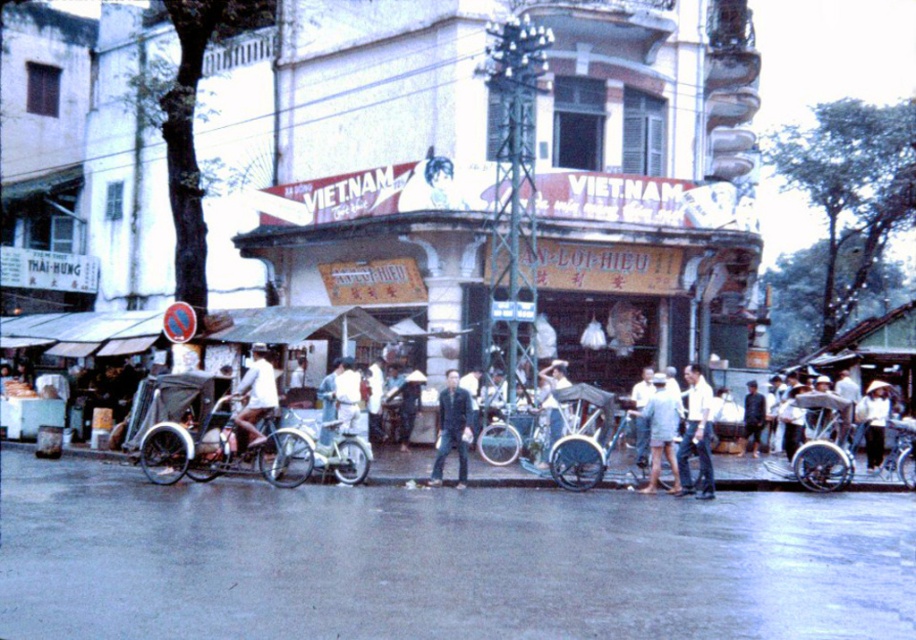
Who is positioned more to the left, metallic silver tricycle at right or dark blue fabric at center?

From the viewer's perspective, metallic silver tricycle at right appears more on the left side.

Does metallic silver tricycle at right have a greater height compared to dark blue fabric at center?

Incorrect, metallic silver tricycle at right's height is not larger of dark blue fabric at center's.

What do you see at coordinates (824, 444) in the screenshot?
I see `metallic silver tricycle at right` at bounding box center [824, 444].

Identify the location of metallic silver tricycle at right. The image size is (916, 640). (824, 444).

Is white matte bicycle at center thinner than white cotton hat at center?

Yes.

Can you confirm if white matte bicycle at center is bigger than white cotton hat at center?

No.

Which is in front, point (253, 410) or point (862, 406)?

Point (253, 410) is in front.

The width and height of the screenshot is (916, 640). I want to click on white matte bicycle at center, so click(256, 394).

Can you confirm if white shirt at center is positioned to the left of light blue fabric shirt at center?

In fact, white shirt at center is to the right of light blue fabric shirt at center.

Consider the image. Who is positioned more to the right, white shirt at center or light blue fabric shirt at center?

Positioned to the right is white shirt at center.

Which is in front, point (704, 490) or point (554, 362)?

Point (704, 490)

You are a GUI agent. You are given a task and a screenshot of the screen. Output one action in this format:
    pyautogui.click(x=<x>, y=<y>)
    Task: Click on the white shirt at center
    
    Given the screenshot: What is the action you would take?
    pyautogui.click(x=696, y=435)